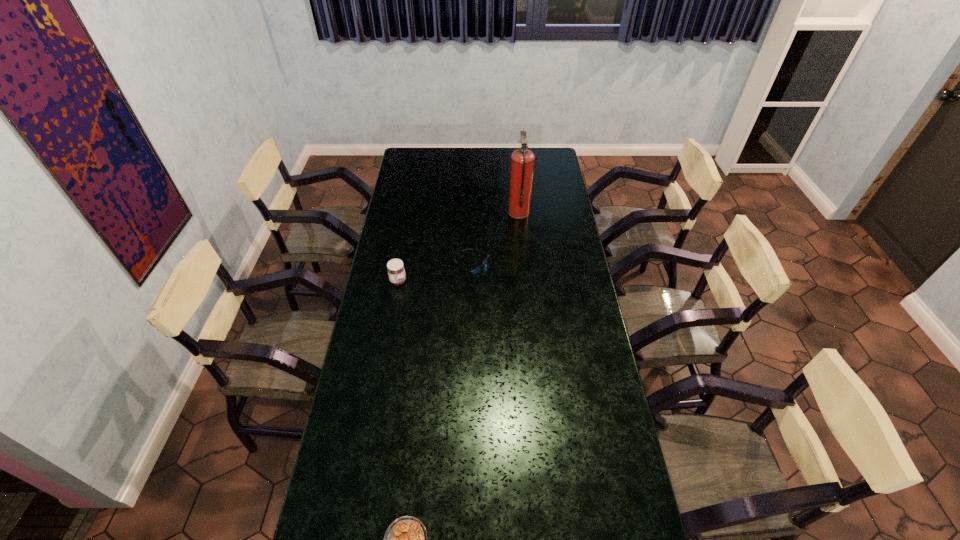
You are a GUI agent. You are given a task and a screenshot of the screen. Output one action in this format:
    pyautogui.click(x=<x>, y=<y>)
    Task: Click on the farthest object
    Image resolution: width=960 pixels, height=540 pixels.
    Given the screenshot: What is the action you would take?
    522,160

The width and height of the screenshot is (960, 540). In order to click on the tallest object in this screenshot , I will do click(522, 160).

Find the location of a particular element. This screenshot has width=960, height=540. jam is located at coordinates (396, 271).

Locate an element on the screen. The width and height of the screenshot is (960, 540). the leftmost object is located at coordinates (396, 271).

At what (x,y) coordinates should I click in order to perform the action: click on sunglasses. Please return your answer as a coordinate pair (x, y). Looking at the image, I should click on (475, 271).

In order to click on the second shortest object in this screenshot , I will do `click(475, 271)`.

The height and width of the screenshot is (540, 960). Find the location of `free space located at the nozzle of the farthest object`. free space located at the nozzle of the farthest object is located at coordinates (481, 213).

Image resolution: width=960 pixels, height=540 pixels. Identify the location of vacant space located at the nozzle of the farthest object. (481, 213).

This screenshot has height=540, width=960. I want to click on vacant space located 0.360m at the nozzle of the farthest object, so click(x=434, y=213).

Where is `vacant area situated 0.280m on the front label of the leftmost object`? The height and width of the screenshot is (540, 960). vacant area situated 0.280m on the front label of the leftmost object is located at coordinates click(x=474, y=281).